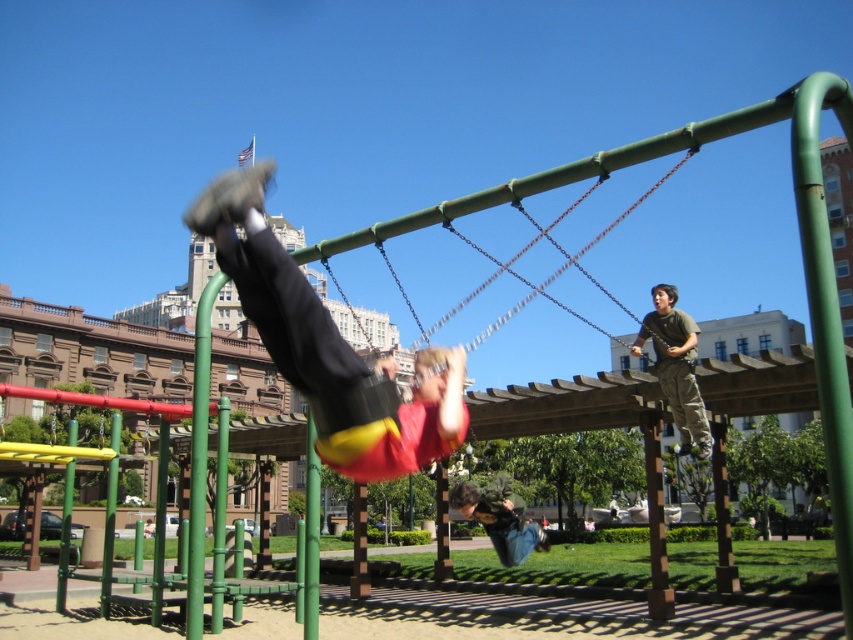
You are a photographer trying to capture a photo of the denim jeans at lower center and the green matte pole at center. If you want to frame both objects in your shot, which object should you position closer to the left side of the camera frame?

The denim jeans at lower center is positioned on the right side of green matte pole at center, so to frame both in the shot, the green matte pole at center should be placed closer to the left side of the camera frame.